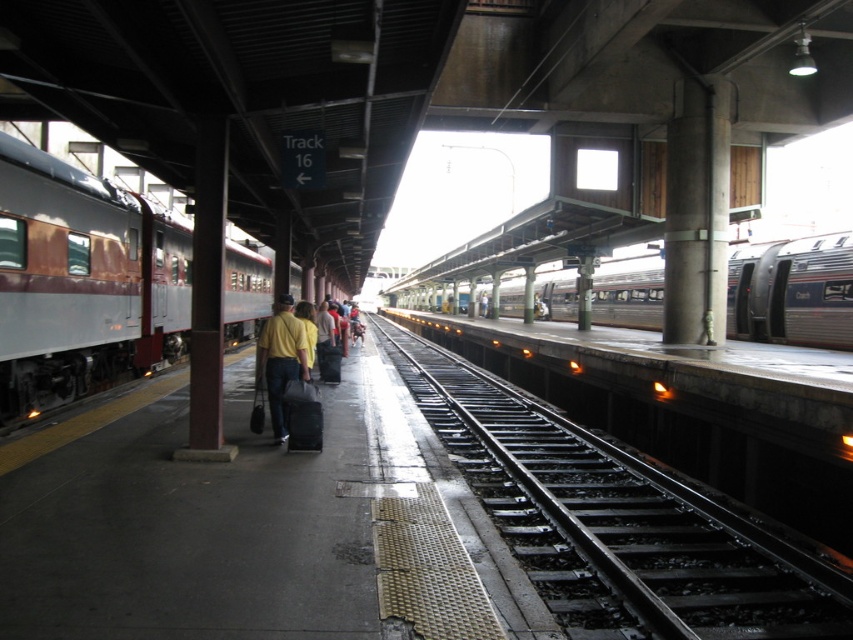
Which is in front, point (699, 592) or point (757, 323)?

Point (699, 592) is in front.

Identify the location of black metal train track at center. This screenshot has width=853, height=640. (618, 518).

Find the location of a particular element. black metal train track at center is located at coordinates (618, 518).

Does concrete platform at center have a lesser width compared to rustic metal train at left?

Indeed, concrete platform at center has a lesser width compared to rustic metal train at left.

Between point (254, 529) and point (148, 262), which one is positioned in front?

Point (254, 529)

In order to click on concrete platform at center in this screenshot , I will do `click(231, 528)`.

Does concrete platform at center have a smaller size compared to yellow matte shirt at center?

No.

Is the position of concrete platform at center more distant than that of yellow matte shirt at center?

No, it is in front of yellow matte shirt at center.

Who is more distant from viewer, (119, 515) or (270, 416)?

Positioned behind is point (270, 416).

At what (x,y) coordinates should I click in order to perform the action: click on concrete platform at center. Please return your answer as a coordinate pair (x, y). The width and height of the screenshot is (853, 640). Looking at the image, I should click on (231, 528).